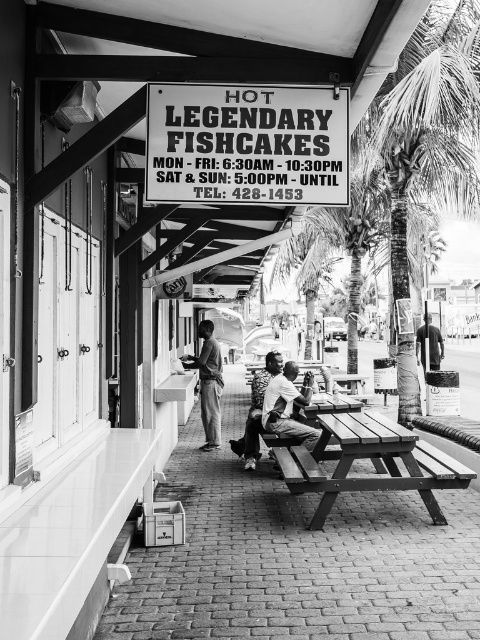
Question: Which point appears closest to the camera in this image?

Choices:
 (A) (217, 435)
 (B) (465, 477)
 (C) (423, 330)
 (D) (437, 112)

Answer: (B)

Question: Is white paper sign at upper center thinner than coarse textured palm tree at right?

Choices:
 (A) yes
 (B) no

Answer: (B)

Question: Among these objects, which one is nearest to the camera?

Choices:
 (A) wooden picnic table at center
 (B) light skin tone shirt at center

Answer: (A)

Question: In this image, where is dark skin textured shirt at center located relative to light skin tone shirt at center?

Choices:
 (A) below
 (B) above

Answer: (B)

Question: Can you confirm if coarse textured palm tree at right is positioned to the left of wooden picnic table at center?

Choices:
 (A) no
 (B) yes

Answer: (A)

Question: Which object is positioned farthest from the dark gray shirt at center?

Choices:
 (A) dark skin textured shirt at center
 (B) white paper sign at upper center

Answer: (B)